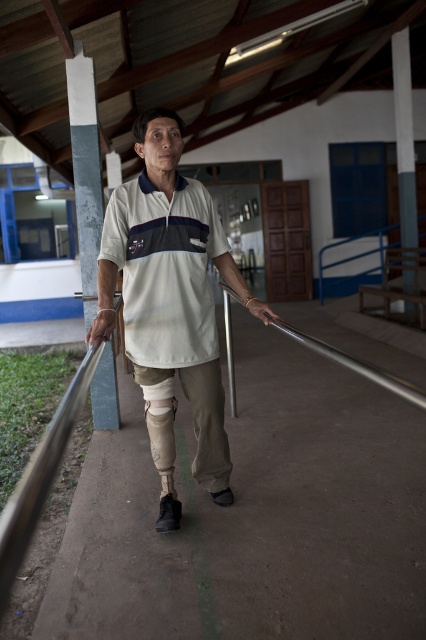
Between smooth gray pole at upper right and silver metallic rail at center, which one appears on the right side from the viewer's perspective?

smooth gray pole at upper right

Find the location of `smooth gray pole at upper right`. smooth gray pole at upper right is located at coordinates (405, 138).

Identify the location of smooth gray pole at upper right. (405, 138).

Between point (213, 225) and point (339, 353), which one is positioned in front?

Positioned in front is point (339, 353).

Where is `white matte polo shirt at center`? The height and width of the screenshot is (640, 426). white matte polo shirt at center is located at coordinates (164, 269).

In order to click on white matte polo shirt at center in this screenshot , I will do click(x=164, y=269).

This screenshot has width=426, height=640. Describe the element at coordinates (164, 269) in the screenshot. I see `white matte polo shirt at center` at that location.

Describe the element at coordinates (164, 269) in the screenshot. I see `white matte polo shirt at center` at that location.

Locate an element on the screen. white matte polo shirt at center is located at coordinates (164, 269).